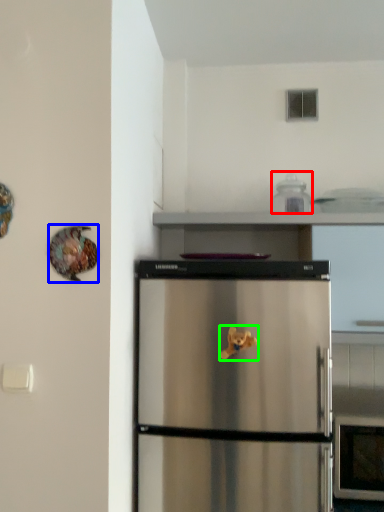
Question: Which is nearer to the appliance (highlighted by a red box)? animal (highlighted by a blue box) or toy (highlighted by a green box).

Choices:
 (A) animal
 (B) toy

Answer: (B)